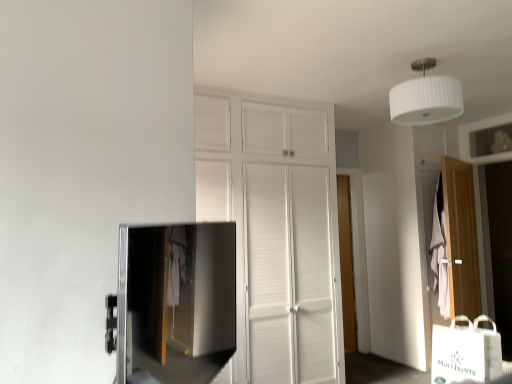
Question: Is white ribbed shade at upper center wider or thinner than white paper bag at lower right?

Choices:
 (A) thin
 (B) wide

Answer: (B)

Question: From a real-world perspective, relative to white paper bag at lower right, is white ribbed shade at upper center vertically above or below?

Choices:
 (A) below
 (B) above

Answer: (B)

Question: Estimate the real-world distances between objects in this image. Which object is closer to the wooden door at right, which appears as the 1th door when viewed from the front?

Choices:
 (A) white paper bag at lower right
 (B) wooden door at center, which is counted as the first door, starting from the back
 (C) pink fabric at right
 (D) white ribbed shade at upper center
 (E) satin black tv at lower left

Answer: (C)

Question: Considering the real-world distances, which object is closest to the wooden door at right, positioned as the first door in right-to-left order?

Choices:
 (A) white ribbed shade at upper center
 (B) satin black tv at lower left
 (C) wooden door at center, which is counted as the 1th door, starting from the left
 (D) pink fabric at right
 (E) white paper bag at lower right

Answer: (D)